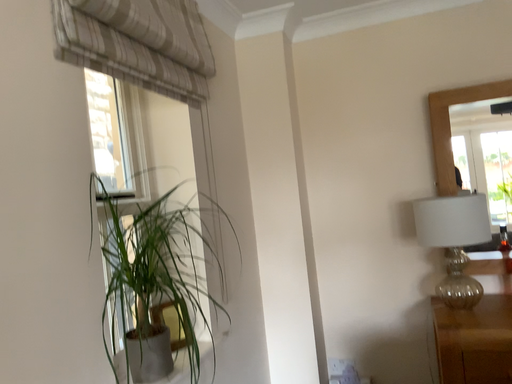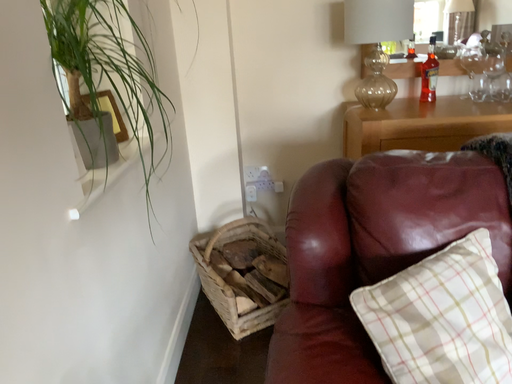
Question: How did the camera likely rotate when shooting the video?

Choices:
 (A) rotated right
 (B) rotated left

Answer: (A)